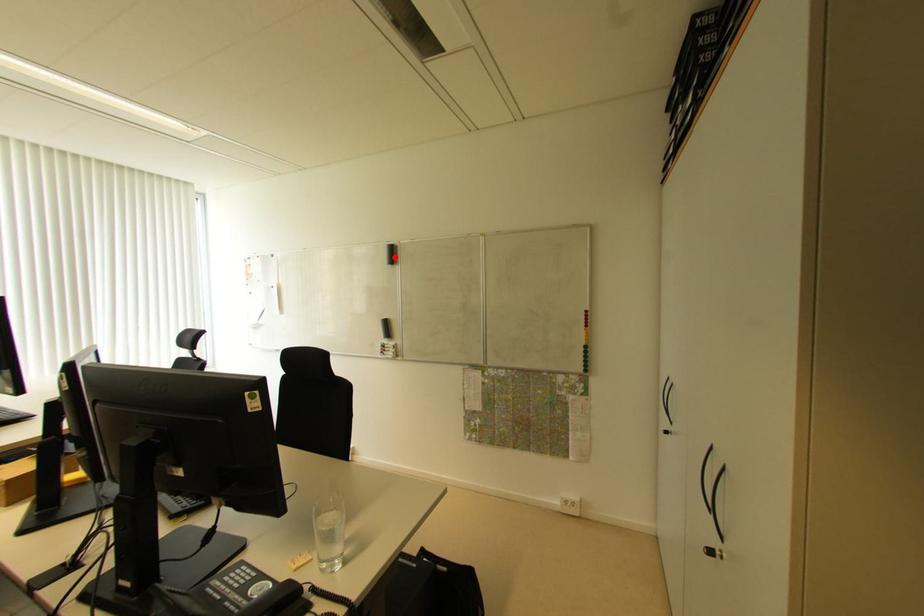
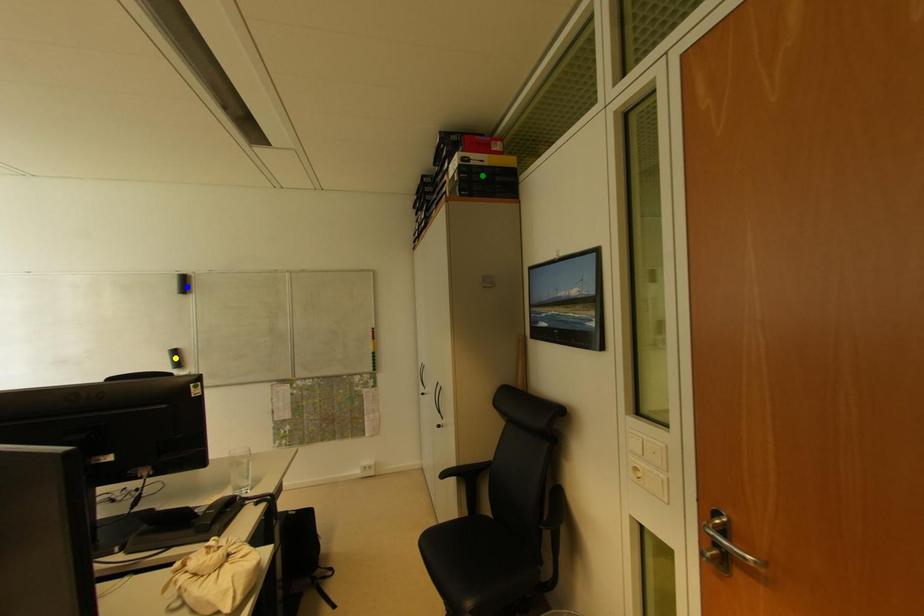
Question: I am providing you with two images of the same scene from different viewpoints. A red point is marked on the first image. You are given multiple points on the second image. In image 2, which mark is for the same physical point as the one in image 1?

Choices:
 (A) blue point
 (B) green point
 (C) yellow point

Answer: (A)